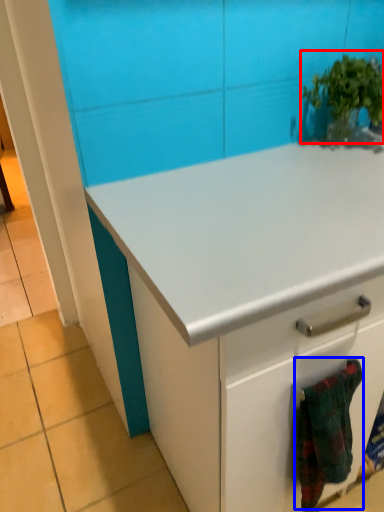
Question: Among these objects, which one is nearest to the camera, houseplant (highlighted by a red box) or blanket (highlighted by a blue box)?

Choices:
 (A) houseplant
 (B) blanket

Answer: (B)